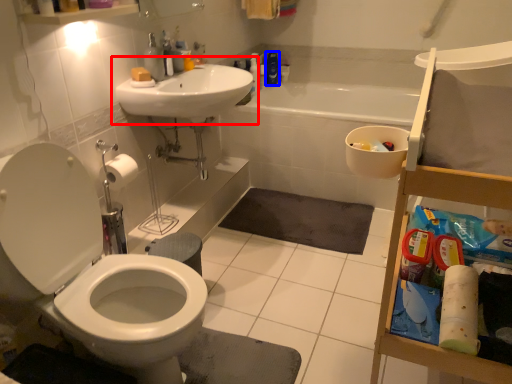
Question: Which object is further to the camera taking this photo, sink (highlighted by a red box) or cleaning product (highlighted by a blue box)?

Choices:
 (A) sink
 (B) cleaning product

Answer: (B)